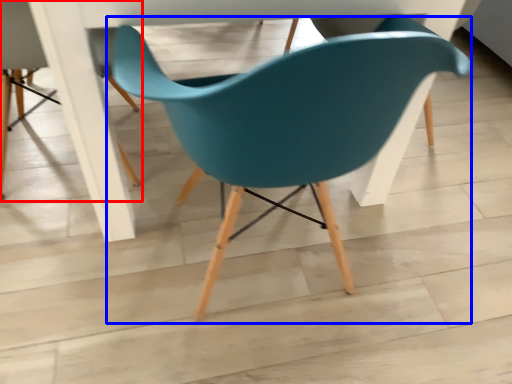
Question: Which object appears farthest to the camera in this image, chair (highlighted by a red box) or chair (highlighted by a blue box)?

Choices:
 (A) chair
 (B) chair

Answer: (A)